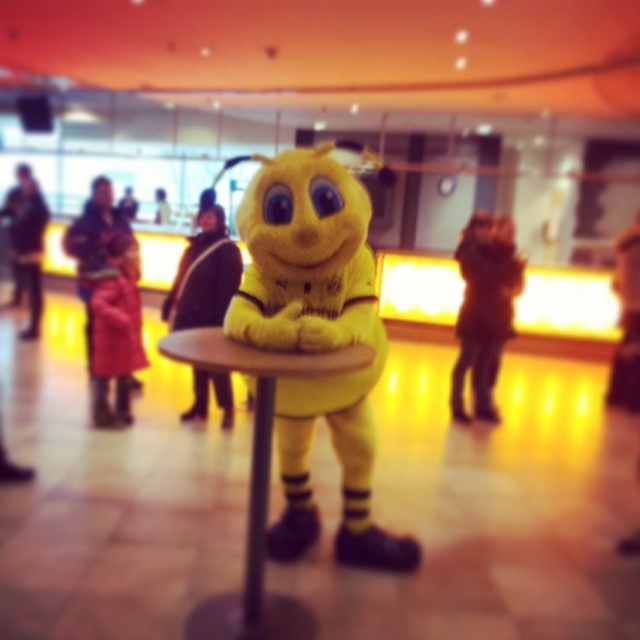
You are organizing a coat rack and have two coats to hang. The velvet red coat at left and the red wool coat at left are both on a hanger. Which coat will require less space on the rack?

The velvet red coat at left is thinner than the red wool coat at left, so it will require less space on the rack.

Looking at this image, you are a store manager organizing a coat rack in the store. You have two coats to place on the rack. The dark brown leather coat at center and the red wool coat at left. The store requires that coats must be at least 15 feet apart for visibility. Can you place them on the rack as per the requirement?

The dark brown leather coat at center and the red wool coat at left are 17.38 feet apart from each other, which exceeds the minimum required distance of 15 feet. Therefore, they can be placed on the rack as per the store requirement.